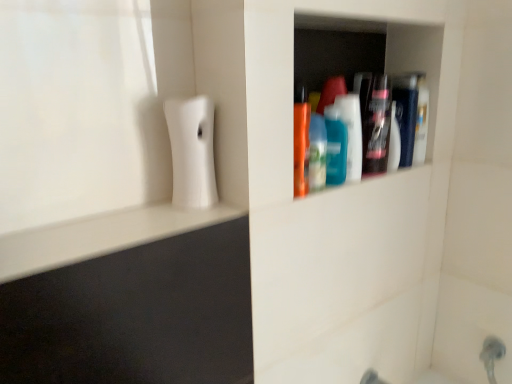
Question: From a real-world perspective, is teal glossy mouthwash at center, which is the 2th mouthwash in right-to-left order, positioned above or below translucent plastic mouthwash at upper right, placed as the 1th mouthwash when sorted from right to left?

Choices:
 (A) above
 (B) below

Answer: (B)

Question: Is point (351, 155) positioned closer to the camera than point (400, 92)?

Choices:
 (A) closer
 (B) farther

Answer: (A)

Question: Considering the real-world distances, which object is farthest from the teal glossy mouthwash at center, the second mouthwash when ordered from left to right?

Choices:
 (A) translucent blue bottle at center, positioned as the third mouthwash in right-to-left order
 (B) translucent plastic mouthwash at upper right, the third mouthwash when ordered from left to right

Answer: (B)

Question: Which is farther from the translucent blue bottle at center, placed as the 1th mouthwash when sorted from left to right?

Choices:
 (A) teal glossy mouthwash at center, which is the 2th mouthwash in right-to-left order
 (B) translucent plastic mouthwash at upper right, the third mouthwash when ordered from left to right

Answer: (B)